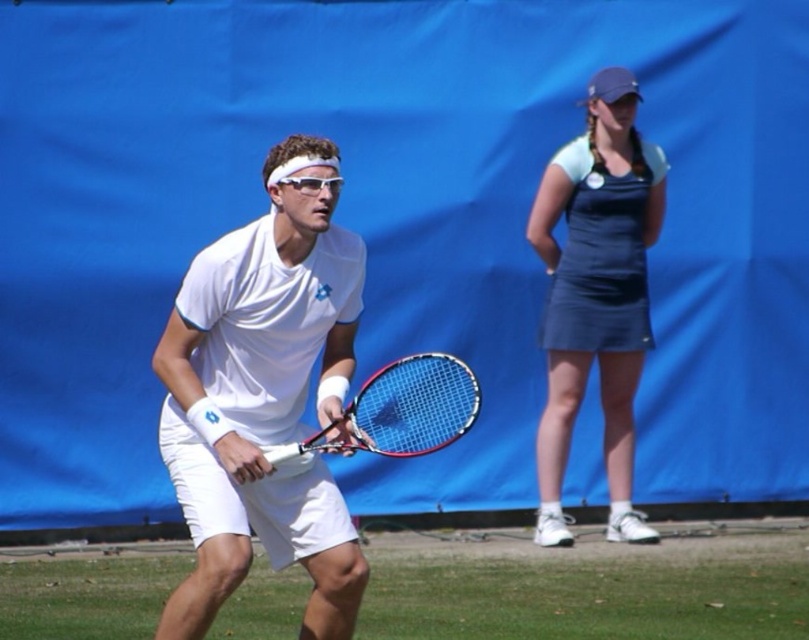
You are a photographer positioned at the center of the court. You want to capture a photo that includes both the dark blue fabric dress at upper right and the matte blue racket at center. Based on their positions, which object should you focus on first to ensure both are in frame?

The dark blue fabric dress at upper right is above the matte blue racket at center, so you should focus on the matte blue racket at center first to ensure both are in frame.

You are a tennis ball that just flew over the net. You need to decide whether to land in front of or behind the dark blue fabric dress at upper right. Based on the position of the matte blue racket at center, where should you land?

The matte blue racket at center is behind dark blue fabric dress at upper right, so the ball should land in front of the dark blue fabric dress at upper right to stay within the court.

You are a tennis player standing at the baseline and see two points marked on the court. Which point, point (259, 330) or point (403, 362), is closer to you?

Point (259, 330) is closer to the viewer than point (403, 362).